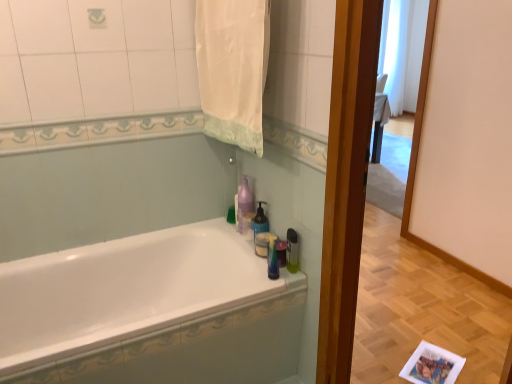
Image resolution: width=512 pixels, height=384 pixels. Identify the location of purple glossy bottle at upper center. (244, 202).

What do you see at coordinates (151, 312) in the screenshot?
I see `white glossy bathtub at center` at bounding box center [151, 312].

Locate an element on the screen. white glossy bathtub at center is located at coordinates (151, 312).

What do you see at coordinates (292, 251) in the screenshot?
I see `translucent plastic soap dispenser at right` at bounding box center [292, 251].

Describe the element at coordinates (260, 221) in the screenshot. I see `translucent plastic soap dispenser at upper center` at that location.

Describe the element at coordinates (233, 68) in the screenshot. I see `white fabric towel at upper center` at that location.

Where is `purple glossy bottle at upper center`? This screenshot has height=384, width=512. purple glossy bottle at upper center is located at coordinates (244, 202).

In the scene shown: From a real-world perspective, is translucent plastic soap dispenser at right positioned over purple glossy bottle at upper center based on gravity?

No, from a real-world perspective, translucent plastic soap dispenser at right is not above purple glossy bottle at upper center.

Which object is closer to the camera taking this photo, translucent plastic soap dispenser at right or purple glossy bottle at upper center?

translucent plastic soap dispenser at right is in front.

From the image's perspective, which one is positioned higher, translucent plastic soap dispenser at right or purple glossy bottle at upper center?

From the image's view, purple glossy bottle at upper center is above.

Who is taller, translucent plastic soap dispenser at right or purple glossy bottle at upper center?

With more height is purple glossy bottle at upper center.

Would you consider white glossy bathtub at center to be distant from translucent plastic soap dispenser at upper center?

No, white glossy bathtub at center is not far away from translucent plastic soap dispenser at upper center.

Does point (139, 257) appear closer or farther from the camera than point (254, 220)?

Point (139, 257) appears to be farther away from the viewer than point (254, 220).

Considering the relative sizes of white glossy bathtub at center and translucent plastic soap dispenser at upper center in the image provided, is white glossy bathtub at center wider than translucent plastic soap dispenser at upper center?

Yes.

Does white glossy bathtub at center lie behind translucent plastic soap dispenser at upper center?

That is False.

Considering the sizes of objects white fabric towel at upper center and purple glossy bottle at upper center in the image provided, who is smaller, white fabric towel at upper center or purple glossy bottle at upper center?

Smaller between the two is purple glossy bottle at upper center.

Is purple glossy bottle at upper center surrounded by white fabric towel at upper center?

No, purple glossy bottle at upper center is located outside of white fabric towel at upper center.

Is there a large distance between white fabric towel at upper center and purple glossy bottle at upper center?

white fabric towel at upper center is near purple glossy bottle at upper center, not far away.

Which of these two, purple glossy bottle at upper center or white fabric towel at upper center, stands shorter?

Standing shorter between the two is purple glossy bottle at upper center.

Between purple glossy bottle at upper center and white fabric towel at upper center, which one appears on the left side from the viewer's perspective?

Positioned to the left is white fabric towel at upper center.

Is purple glossy bottle at upper center situated inside white fabric towel at upper center or outside?

purple glossy bottle at upper center is located beyond the bounds of white fabric towel at upper center.

You are a GUI agent. You are given a task and a screenshot of the screen. Output one action in this format:
    pyautogui.click(x=<x>, y=<y>)
    Task: Click on the cleaning product on the right of white fabric towel at upper center
    
    Given the screenshot: What is the action you would take?
    pyautogui.click(x=244, y=202)

Is white fabric towel at upper center completely or partially inside translucent plastic soap dispenser at upper center?

No, white fabric towel at upper center is located outside of translucent plastic soap dispenser at upper center.

From a real-world perspective, is translucent plastic soap dispenser at upper center located higher than white fabric towel at upper center?

Incorrect, from a real-world perspective, translucent plastic soap dispenser at upper center is lower than white fabric towel at upper center.

Would you say translucent plastic soap dispenser at upper center is to the left or to the right of white fabric towel at upper center in the picture?

translucent plastic soap dispenser at upper center is positioned on white fabric towel at upper center's right side.

Based on their sizes in the image, would you say translucent plastic soap dispenser at upper center is bigger or smaller than white fabric towel at upper center?

Clearly, translucent plastic soap dispenser at upper center is smaller in size than white fabric towel at upper center.

Which object is positioned more to the left, purple glossy bottle at upper center or translucent plastic soap dispenser at upper center?

From the viewer's perspective, purple glossy bottle at upper center appears more on the left side.

Can you tell me how much purple glossy bottle at upper center and translucent plastic soap dispenser at upper center differ in facing direction?

There is a 0.000181-degree angle between the facing directions of purple glossy bottle at upper center and translucent plastic soap dispenser at upper center.

Is purple glossy bottle at upper center thinner than translucent plastic soap dispenser at upper center?

Incorrect, the width of purple glossy bottle at upper center is not less than that of translucent plastic soap dispenser at upper center.

You are a GUI agent. You are given a task and a screenshot of the screen. Output one action in this format:
    pyautogui.click(x=<x>, y=<y>)
    Task: Click on the soap dispenser on the right of purple glossy bottle at upper center
    The image size is (512, 384).
    Given the screenshot: What is the action you would take?
    pyautogui.click(x=260, y=221)

Which is farther from the camera, (x=89, y=251) or (x=297, y=235)?

The point (x=89, y=251) is farther.

Who is shorter, white glossy bathtub at center or translucent plastic soap dispenser at right?

translucent plastic soap dispenser at right is shorter.

Which is more to the left, white glossy bathtub at center or translucent plastic soap dispenser at right?

From the viewer's perspective, white glossy bathtub at center appears more on the left side.

Do you think white glossy bathtub at center is within translucent plastic soap dispenser at right, or outside of it?

white glossy bathtub at center is located beyond the bounds of translucent plastic soap dispenser at right.

Locate an element on the screen. toiletry below the purple glossy bottle at upper center (from the image's perspective) is located at coordinates (292, 251).

Locate an element on the screen. The image size is (512, 384). soap dispenser above the white glossy bathtub at center (from the image's perspective) is located at coordinates (260, 221).

From the image, which object appears to be farther from white glossy bathtub at center, translucent plastic soap dispenser at right or white fabric towel at upper center?

white fabric towel at upper center is positioned further to the anchor white glossy bathtub at center.

Looking at this image, from the image, which object appears to be farther from purple glossy bottle at upper center, white glossy bathtub at center or white fabric towel at upper center?

white glossy bathtub at center is further to purple glossy bottle at upper center.

Looking at the image, which one is located closer to translucent plastic soap dispenser at upper center, purple glossy bottle at upper center or translucent plastic soap dispenser at right?

Based on the image, purple glossy bottle at upper center appears to be nearer to translucent plastic soap dispenser at upper center.

When comparing their distances from purple glossy bottle at upper center, does translucent plastic soap dispenser at right or translucent plastic soap dispenser at upper center seem further?

translucent plastic soap dispenser at right lies further to purple glossy bottle at upper center than the other object.

Based on the photo, which object lies further to the anchor point white fabric towel at upper center, translucent plastic soap dispenser at right or translucent plastic soap dispenser at upper center?

translucent plastic soap dispenser at right lies further to white fabric towel at upper center than the other object.

Looking at the image, which one is located further to white fabric towel at upper center, translucent plastic soap dispenser at upper center or purple glossy bottle at upper center?

translucent plastic soap dispenser at upper center.

Looking at this image, when comparing their distances from white glossy bathtub at center, does white fabric towel at upper center or translucent plastic soap dispenser at upper center seem further?

The object further to white glossy bathtub at center is white fabric towel at upper center.

Looking at the image, which one is located further to purple glossy bottle at upper center, translucent plastic soap dispenser at right or white glossy bathtub at center?

white glossy bathtub at center is further to purple glossy bottle at upper center.

The height and width of the screenshot is (384, 512). Find the location of `soap dispenser between white glossy bathtub at center and purple glossy bottle at upper center along the z-axis`. soap dispenser between white glossy bathtub at center and purple glossy bottle at upper center along the z-axis is located at coordinates (260, 221).

At what (x,y) coordinates should I click in order to perform the action: click on cleaning product between white fabric towel at upper center and white glossy bathtub at center in the up-down direction. Please return your answer as a coordinate pair (x, y). Looking at the image, I should click on (244, 202).

Where is `toiletry between white glossy bathtub at center and purple glossy bottle at upper center from front to back`? The image size is (512, 384). toiletry between white glossy bathtub at center and purple glossy bottle at upper center from front to back is located at coordinates (292, 251).

Where is `soap dispenser between white fabric towel at upper center and translucent plastic soap dispenser at right from top to bottom`? soap dispenser between white fabric towel at upper center and translucent plastic soap dispenser at right from top to bottom is located at coordinates (260, 221).